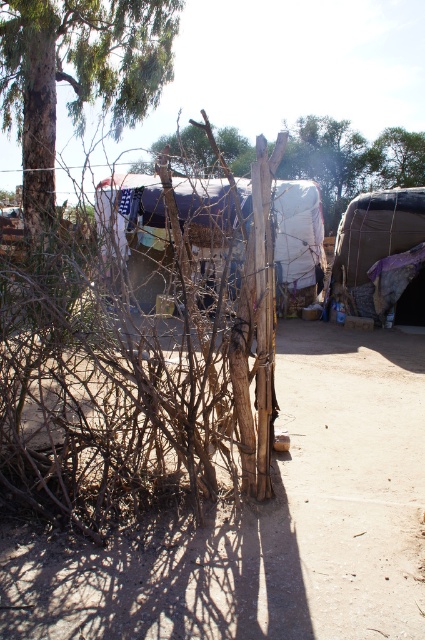
Question: Estimate the real-world distances between objects in this image. Which object is farther from the green rough bark tree at upper left?

Choices:
 (A) green leafy tree at upper center
 (B) brown rough wood at center

Answer: (A)

Question: Among these points, which one is nearest to the camera?

Choices:
 (A) coord(371,198)
 (B) coord(93,356)
 (C) coord(410,140)
 (D) coord(328,189)

Answer: (B)

Question: Can you confirm if brown rough wood at center is bigger than green leafy tree at upper center?

Choices:
 (A) yes
 (B) no

Answer: (A)

Question: Is white fabric tent at center closer to camera compared to green leafy tree at upper center?

Choices:
 (A) no
 (B) yes

Answer: (B)

Question: Can you confirm if brown dry wood at center is positioned to the left of white fabric tent at center?

Choices:
 (A) no
 (B) yes

Answer: (B)

Question: Which object is farther from the camera taking this photo?

Choices:
 (A) green rough bark tree at upper left
 (B) textured brown fabric tent at center
 (C) green leafy tree at upper center
 (D) white fabric tent at center

Answer: (C)